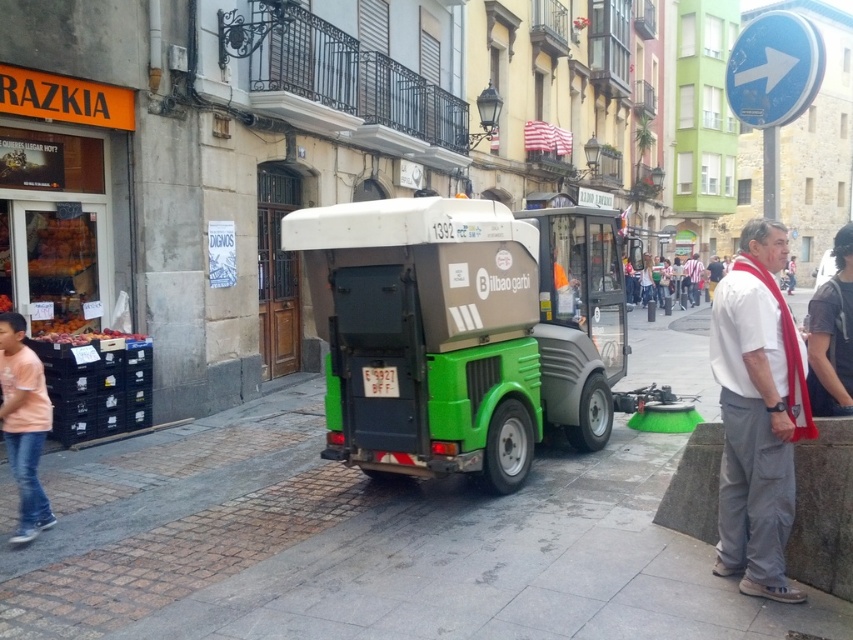
Question: Can you confirm if green rubber pavement at center is smaller than pink cotton shirt at lower left?

Choices:
 (A) yes
 (B) no

Answer: (B)

Question: Considering the relative positions of green rubber pavement at center and red scarf at right in the image provided, where is green rubber pavement at center located with respect to red scarf at right?

Choices:
 (A) left
 (B) right

Answer: (A)

Question: Which object is the closest to the green matte cleaning cart at center?

Choices:
 (A) white matte shirt at center
 (B) green rubber pavement at center

Answer: (B)

Question: Considering the real-world distances, which object is farthest from the green rubber pavement at center?

Choices:
 (A) pink cotton shirt at lower left
 (B) green matte cleaning cart at center
 (C) red scarf at right
 (D) white matte shirt at center

Answer: (C)

Question: Which point appears closest to the camera in this image?

Choices:
 (A) (808, 358)
 (B) (22, 365)
 (C) (490, 224)

Answer: (A)

Question: Is green rubber pavement at center above pink cotton shirt at lower left?

Choices:
 (A) yes
 (B) no

Answer: (B)